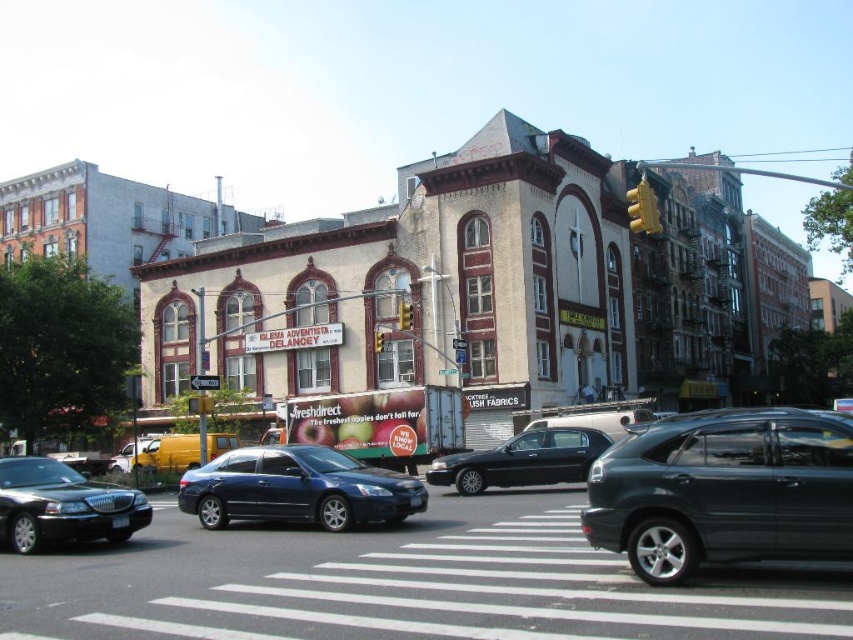
Question: Which point is closer to the camera?

Choices:
 (A) (630, 531)
 (B) (141, 436)
 (C) (71, 483)

Answer: (A)

Question: Which object is positioned closest to the yellow matte traffic light at upper right?

Choices:
 (A) yellow plastic traffic light at center
 (B) metallic silver car at lower left
 (C) glossy black suv at center right
 (D) matte blue sedan at center

Answer: (A)

Question: Is matte blue sedan at center to the left of shiny black sedan at center from the viewer's perspective?

Choices:
 (A) no
 (B) yes

Answer: (B)

Question: Is white asphalt at center above yellow plastic traffic light at center?

Choices:
 (A) yes
 (B) no

Answer: (B)

Question: Is the position of matte blue sedan at center more distant than that of metallic silver car at lower left?

Choices:
 (A) no
 (B) yes

Answer: (A)

Question: Estimate the real-world distances between objects in this image. Which object is farther from the metallic silver car at lower left?

Choices:
 (A) matte blue sedan at center
 (B) yellow plastic traffic light at center
 (C) shiny black limousine at lower left

Answer: (C)